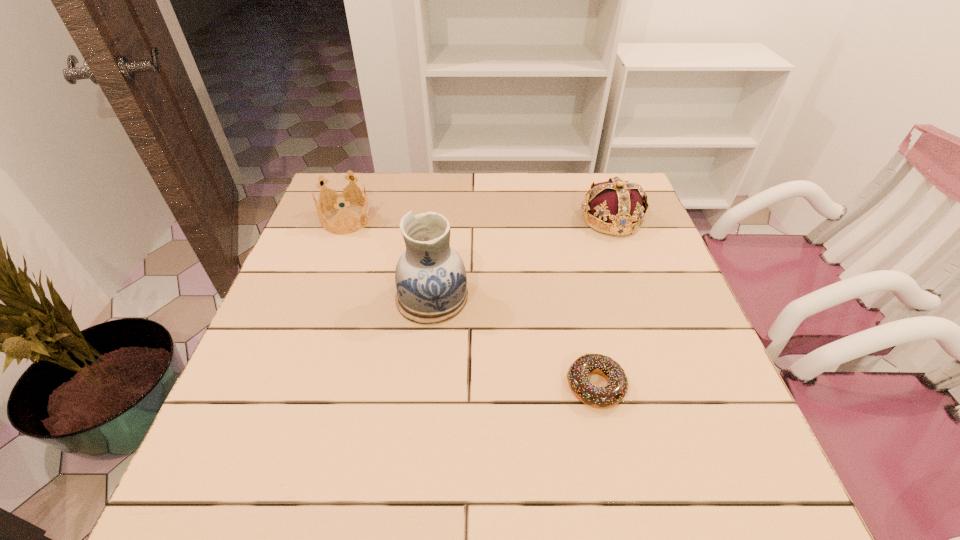
You are a GUI agent. You are given a task and a screenshot of the screen. Output one action in this format:
    pyautogui.click(x=<x>, y=<y>)
    Task: Click on the second object from left to right
    The image size is (960, 540).
    Given the screenshot: What is the action you would take?
    pyautogui.click(x=430, y=276)

Locate an element on the screen. the second nearest object is located at coordinates (430, 276).

You are a GUI agent. You are given a task and a screenshot of the screen. Output one action in this format:
    pyautogui.click(x=<x>, y=<y>)
    Task: Click on the right crown
    This screenshot has width=960, height=540.
    Given the screenshot: What is the action you would take?
    pyautogui.click(x=618, y=203)

Find the location of a particular element. the leftmost object is located at coordinates (340, 197).

Where is `the shorter crown`? The image size is (960, 540). the shorter crown is located at coordinates (340, 197).

I want to click on doughnut, so click(616, 389).

This screenshot has width=960, height=540. What are the coordinates of `the nearest object` in the screenshot? It's located at (616, 389).

The width and height of the screenshot is (960, 540). I want to click on vacant space located on the front of the third object from right to left, so click(x=425, y=359).

Image resolution: width=960 pixels, height=540 pixels. What are the coordinates of `vacant space located on the front of the right crown` in the screenshot? It's located at (659, 353).

Where is `blank area located on the back of the left crown`? blank area located on the back of the left crown is located at coordinates (362, 177).